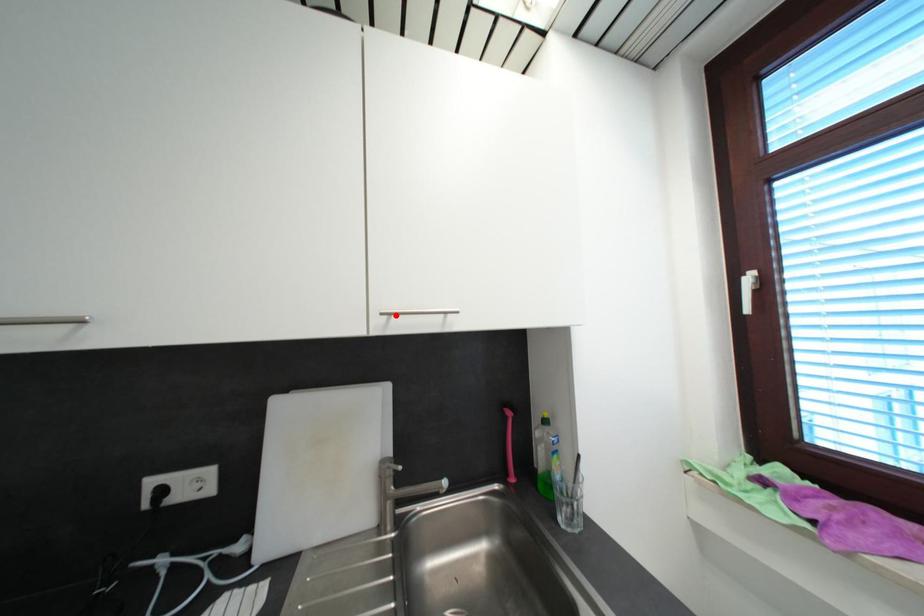
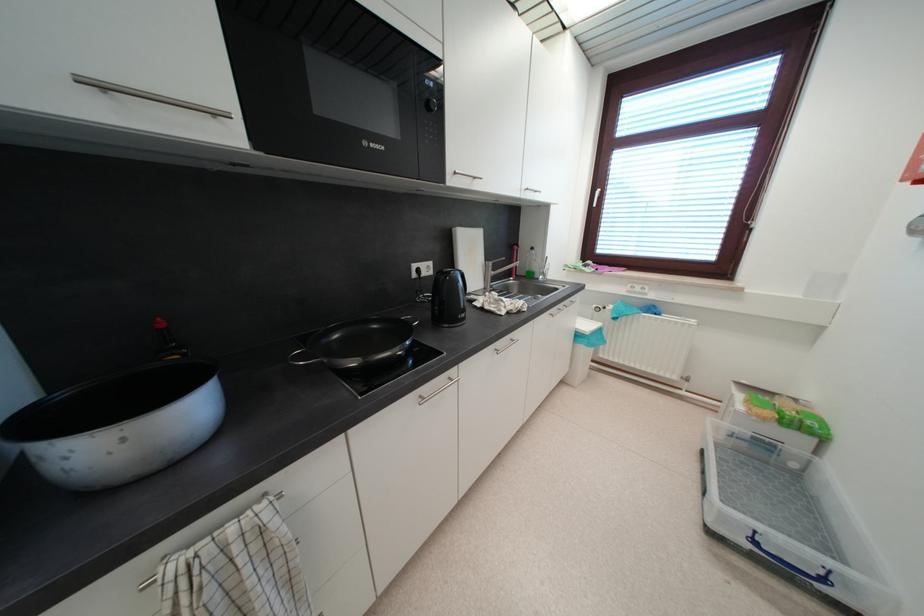
Question: I am providing you with two images of the same scene from different viewpoints. Given a red point in image1, look at the same physical point in image2. Is it:

Choices:
 (A) Closer to the viewpoint
 (B) Farther from the viewpoint

Answer: (A)